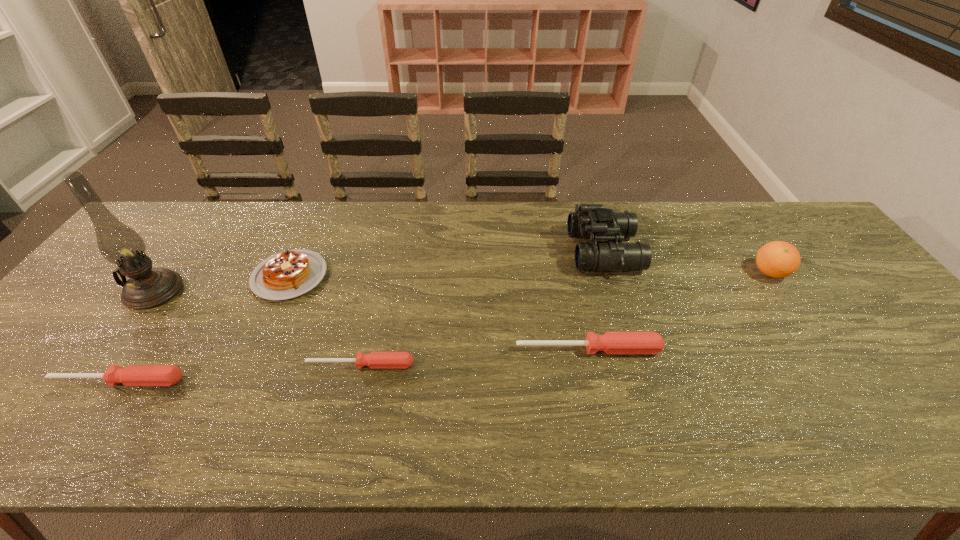
Image resolution: width=960 pixels, height=540 pixels. What are the coordinates of `vacant space that is in between the rightmost screwdriver and the orange` in the screenshot? It's located at (679, 311).

The width and height of the screenshot is (960, 540). Identify the location of blank region between the pancake and the binoculars. (446, 264).

Image resolution: width=960 pixels, height=540 pixels. I want to click on empty space between the tallest object and the fifth farthest object, so click(371, 321).

You are a GUI agent. You are given a task and a screenshot of the screen. Output one action in this format:
    pyautogui.click(x=<x>, y=<y>)
    Task: Click on the free space between the tallest object and the second screwdriver from right to left
    
    Given the screenshot: What is the action you would take?
    pyautogui.click(x=257, y=328)

The height and width of the screenshot is (540, 960). I want to click on free space between the orange and the second tallest screwdriver, so tap(444, 327).

This screenshot has height=540, width=960. What are the coordinates of `blank region between the farthest screwdriver and the nearest screwdriver` in the screenshot? It's located at (353, 365).

Identify the location of free space that is in between the pancake and the third nearest object. Image resolution: width=960 pixels, height=540 pixels. (439, 313).

Find the location of a particular element. This screenshot has width=960, height=540. free space that is in between the nearest screwdriver and the second tallest object is located at coordinates (361, 316).

Where is `vacant space in between the sixth shortest object and the orange`? Image resolution: width=960 pixels, height=540 pixels. vacant space in between the sixth shortest object and the orange is located at coordinates (687, 262).

Select which object is the sixth closest to the nearest object. Please provide its 2D coordinates. Your answer should be formatted as a tuple, i.e. [(x, y)], where the tuple contains the x and y coordinates of a point satisfying the conditions above.

[(777, 259)]